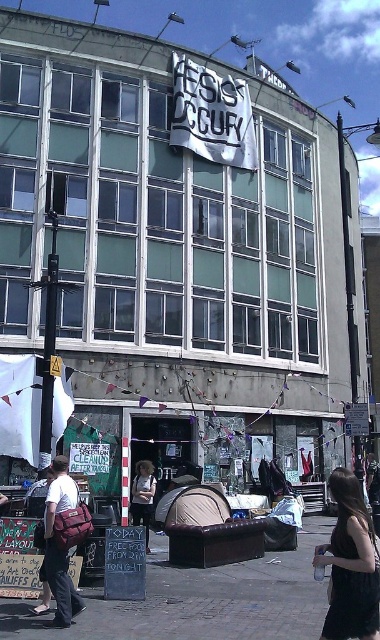
Is the position of brick pavement at center more distant than that of black dress at lower right?

Yes.

Between brick pavement at center and black dress at lower right, which one has less height?

brick pavement at center

At what (x,y) coordinates should I click in order to perform the action: click on brick pavement at center. Please return your answer as a coordinate pair (x, y). Image resolution: width=380 pixels, height=640 pixels. Looking at the image, I should click on (202, 600).

How much distance is there between black dress at lower right and white cotton shirt at center?

The distance of black dress at lower right from white cotton shirt at center is 33.95 feet.

Is point (370, 541) farther from viewer compared to point (131, 502)?

That is False.

Where is `black dress at lower right`? The width and height of the screenshot is (380, 640). black dress at lower right is located at coordinates tap(351, 564).

Who is positioned more to the left, brick pavement at center or white cotton shirt at center?

From the viewer's perspective, white cotton shirt at center appears more on the left side.

Does brick pavement at center appear on the left side of white cotton shirt at center?

No, brick pavement at center is not to the left of white cotton shirt at center.

Locate an element on the screen. Image resolution: width=380 pixels, height=640 pixels. brick pavement at center is located at coordinates (202, 600).